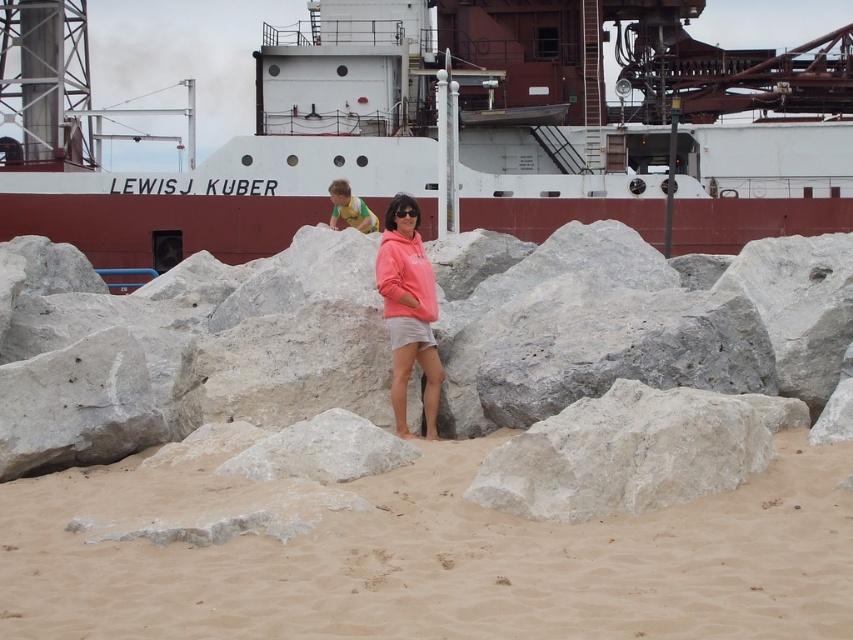
You are a drone operator tasked with capturing aerial footage of the beach scene. The drone is currently hovering 50 feet above the beige sand at lower center. To ensure the matte pink hoodie at center is within the frame, how much closer does the drone need to descend?

The drone needs to descend to 36.50 feet above the beige sand at lower center to capture the matte pink hoodie at center within the frame.

You are a photographer trying to capture a photo of the white matte ship at upper center from the beige sand at lower center. Given that your camera has a maximum focus range of 60 meters, will you be able to take a clear photo of the ship from the sand?

The distance between the white matte ship at upper center and the beige sand at lower center is 65.02 meters, which exceeds the camera maximum focus range of 60 meters. Therefore, you won not be able to take a clear photo of the ship from the sand.